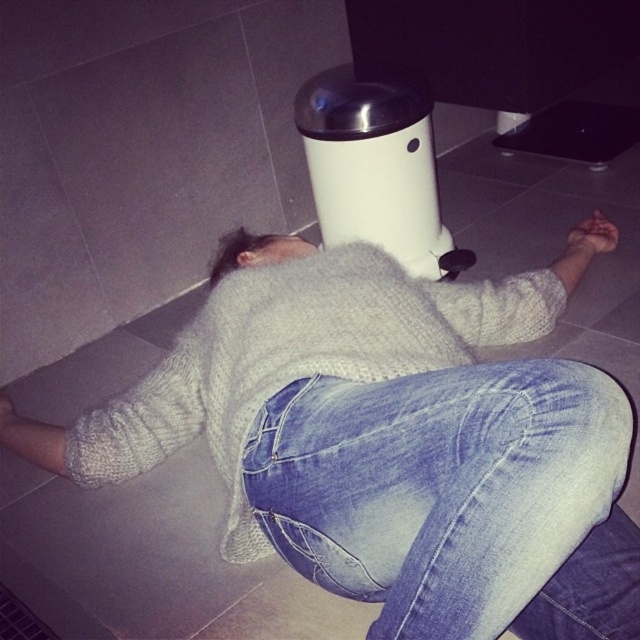
Question: Which of the following is the farthest from the observer?

Choices:
 (A) (401, 176)
 (B) (604, 468)
 (C) (385, 365)

Answer: (A)

Question: Which point appears farthest from the camera in this image?

Choices:
 (A) [x=582, y=456]
 (B) [x=353, y=163]
 (C) [x=124, y=445]

Answer: (B)

Question: Observing the image, what is the correct spatial positioning of denim jeans at lower center in reference to white knitted sweater at center?

Choices:
 (A) right
 (B) left

Answer: (A)

Question: Which point is closer to the camera taking this photo?

Choices:
 (A) (369, 115)
 (B) (358, 310)

Answer: (B)

Question: Does denim jeans at lower center have a larger size compared to white knitted sweater at center?

Choices:
 (A) yes
 (B) no

Answer: (B)

Question: Does denim jeans at lower center appear on the left side of white matte water heater at center?

Choices:
 (A) no
 (B) yes

Answer: (A)